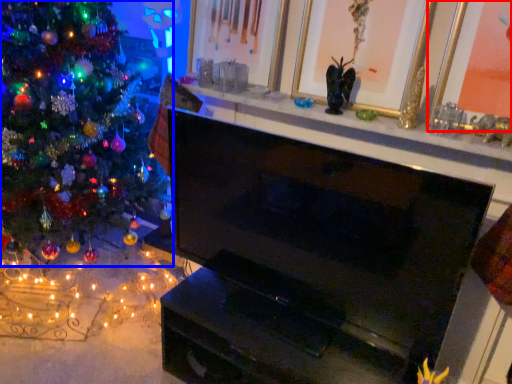
Question: Which object appears closest to the camera in this image, picture frame (highlighted by a red box) or christmas tree (highlighted by a blue box)?

Choices:
 (A) picture frame
 (B) christmas tree

Answer: (A)